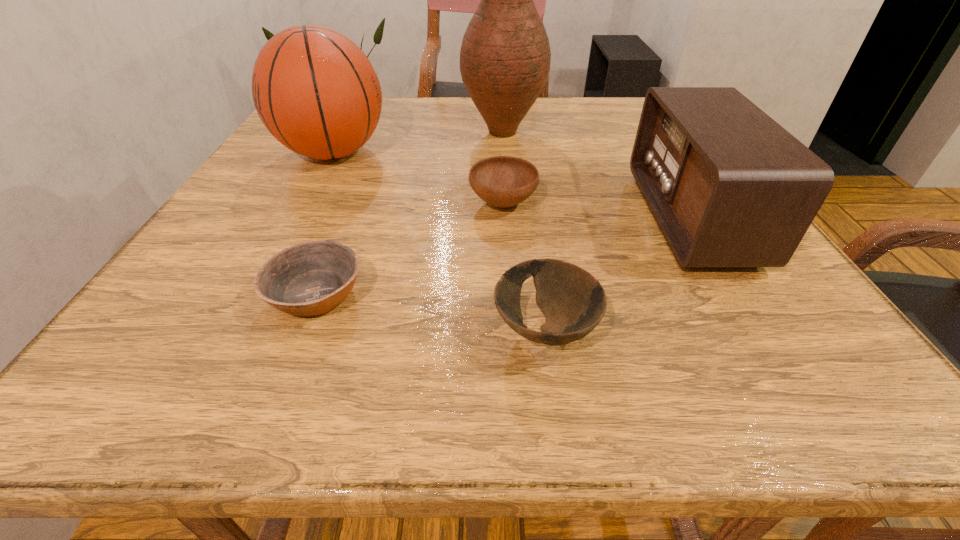
Locate an element on the screen. This screenshot has height=540, width=960. vase is located at coordinates 505,56.

At what (x,y) coordinates should I click in order to perform the action: click on the fifth shortest object. Please return your answer as a coordinate pair (x, y). Looking at the image, I should click on (314, 89).

Find the location of a particular element. The width and height of the screenshot is (960, 540). radio receiver is located at coordinates (729, 187).

In order to click on the fourth shortest object in this screenshot , I will do `click(729, 187)`.

Identify the location of the farthest bowl. This screenshot has height=540, width=960. (503, 181).

Where is `the shortest bowl`? The width and height of the screenshot is (960, 540). the shortest bowl is located at coordinates (310, 278).

I want to click on the shortest object, so click(x=310, y=278).

In order to click on vacant space situated on the front of the tallest object in this screenshot , I will do `click(505, 165)`.

Identify the location of vacant space located on the front of the basketball. The image size is (960, 540). (292, 230).

This screenshot has height=540, width=960. Identify the location of vacant space located on the front-facing side of the fourth shortest object. (478, 218).